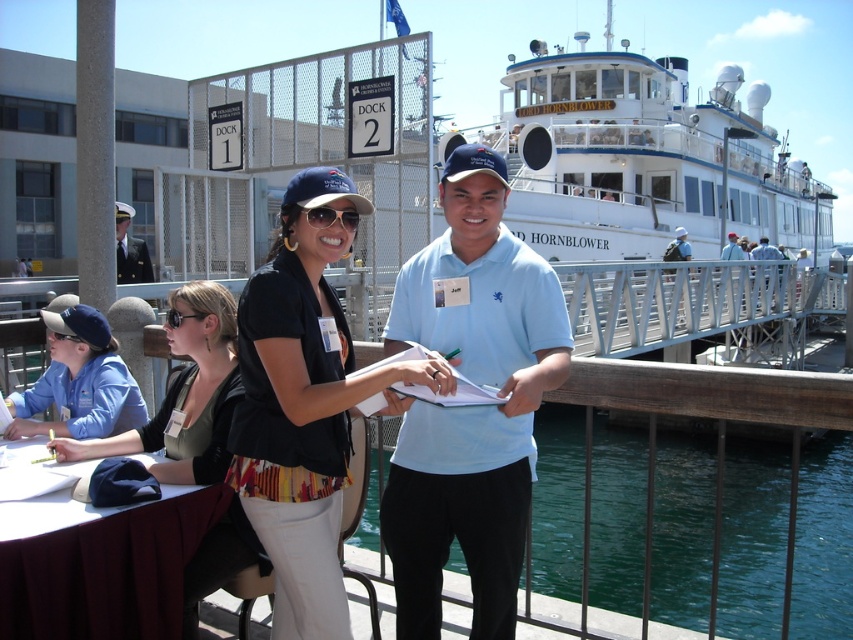
You are a delivery person who needs to place a package between the green liquid water at lower center and the black matte shirt at center. The package requires a minimum of 30 feet of space to be safely placed. Can you safely place the package there?

The green liquid water at lower center and black matte shirt at center are 25.67 feet apart, which is less than the required 30 feet. Therefore, you cannot safely place the package there.

You are a photographer trying to capture the matte black sunglasses at center. The sunglasses are located at coordinates point (x=331, y=218). You need to ensure that your camera is focused on this point. What is the exact coordinate point where the matte black sunglasses at center are located?

The matte black sunglasses at center are located at point (x=331, y=218).

You are a photographer at the dock and want to capture both the black matte shirt at center and the black plastic sunglasses at lower left in a single photo. Based on their positions, which object should you focus on first to ensure both are in frame?

The black plastic sunglasses at lower left should be focused on first since the black matte shirt at center is to the right of it, meaning the sunglasses are positioned to the left and closer to the edge of the frame. By starting with the sunglasses, you can adjust the camera to include both objects in the shot.